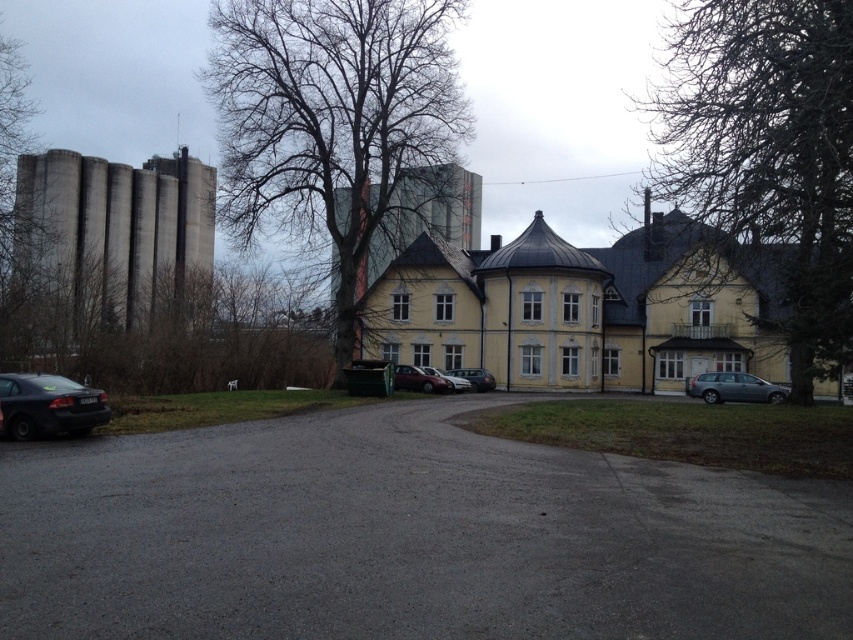
Question: Can you confirm if gray asphalt driveway at center is positioned below shiny red sedan at center?

Choices:
 (A) yes
 (B) no

Answer: (B)

Question: Is the position of bare branches at center less distant than that of metallic silver car at center?

Choices:
 (A) no
 (B) yes

Answer: (B)

Question: Is bare branches at upper center positioned behind satin silver wagon at right?

Choices:
 (A) yes
 (B) no

Answer: (B)

Question: Among these objects, which one is nearest to the camera?

Choices:
 (A) bare branches at upper center
 (B) bare branches at left
 (C) shiny red sedan at center
 (D) metallic silver car at center

Answer: (A)

Question: Which object appears closest to the camera in this image?

Choices:
 (A) satin silver wagon at right
 (B) metallic silver car at center

Answer: (A)

Question: Estimate the real-world distances between objects in this image. Which object is farther from the matte black car at lower left?

Choices:
 (A) gray asphalt driveway at center
 (B) metallic silver car at center

Answer: (B)